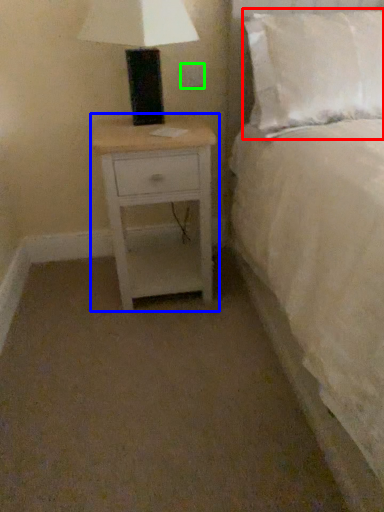
Question: Based on their relative distances, which object is farther from pillow (highlighted by a red box)? Choose from nightstand (highlighted by a blue box) and electric outlet (highlighted by a green box).

Choices:
 (A) nightstand
 (B) electric outlet

Answer: (B)